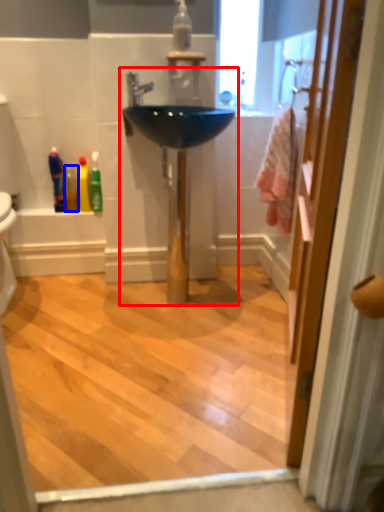
Question: Which object is further to the camera taking this photo, sink (highlighted by a red box) or mouthwash (highlighted by a blue box)?

Choices:
 (A) sink
 (B) mouthwash

Answer: (B)